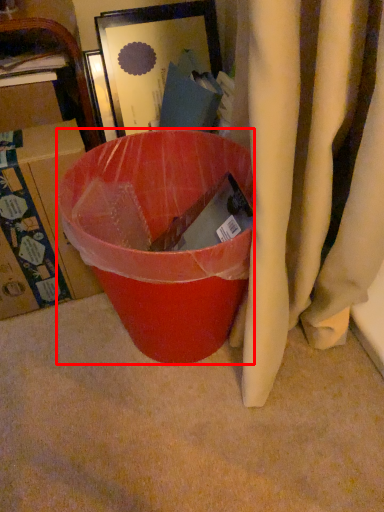
Question: From the image's perspective, where is trash bin/can (annotated by the red box) located in relation to box in the image?

Choices:
 (A) below
 (B) above

Answer: (A)